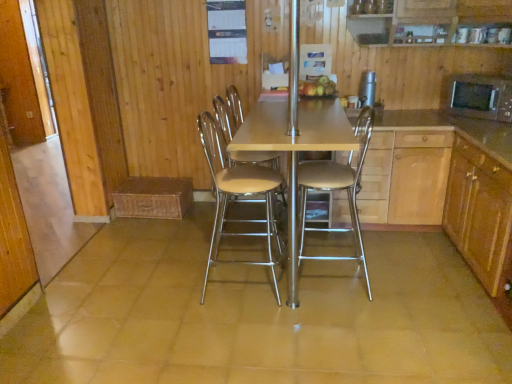
Question: Is matte wooden table at center positioned with its back to shiny golden apples at center?

Choices:
 (A) no
 (B) yes

Answer: (A)

Question: From a real-world perspective, is matte wooden table at center positioned over shiny golden apples at center based on gravity?

Choices:
 (A) yes
 (B) no

Answer: (B)

Question: Is matte wooden table at center bigger than shiny golden apples at center?

Choices:
 (A) yes
 (B) no

Answer: (A)

Question: Is matte wooden table at center completely or partially outside of shiny golden apples at center?

Choices:
 (A) yes
 (B) no

Answer: (A)

Question: From a real-world perspective, is matte wooden table at center under shiny golden apples at center?

Choices:
 (A) yes
 (B) no

Answer: (A)

Question: Considering their positions, is metallic stainless steel water dispenser at upper center, which is the 1th appliance from left to right, located in front of or behind black matte microwave at right, the first appliance viewed from the right?

Choices:
 (A) behind
 (B) front

Answer: (A)

Question: Which is correct: metallic stainless steel water dispenser at upper center, which is the 1th appliance from left to right, is inside black matte microwave at right, the 2th appliance in the left-to-right sequence, or outside of it?

Choices:
 (A) outside
 (B) inside

Answer: (A)

Question: From a real-world perspective, is metallic stainless steel water dispenser at upper center, which is the second appliance from right to left, above or below black matte microwave at right, the first appliance viewed from the right?

Choices:
 (A) above
 (B) below

Answer: (A)

Question: Considering the positions of metallic stainless steel water dispenser at upper center, which is the 1th appliance from left to right, and black matte microwave at right, the first appliance viewed from the right, in the image, is metallic stainless steel water dispenser at upper center, which is the 1th appliance from left to right, wider or thinner than black matte microwave at right, the first appliance viewed from the right,?

Choices:
 (A) wide
 (B) thin

Answer: (B)

Question: Considering their positions, is matte wooden table at center located in front of or behind metallic stainless steel water dispenser at upper center, which is the second appliance from right to left?

Choices:
 (A) behind
 (B) front

Answer: (B)

Question: From the image's perspective, is matte wooden table at center above or below metallic stainless steel water dispenser at upper center, which is the second appliance from right to left?

Choices:
 (A) above
 (B) below

Answer: (B)

Question: Considering the positions of point (326, 173) and point (373, 86), is point (326, 173) closer or farther from the camera than point (373, 86)?

Choices:
 (A) farther
 (B) closer

Answer: (B)

Question: Is matte wooden table at center taller or shorter than metallic stainless steel water dispenser at upper center, which is the 1th appliance from left to right?

Choices:
 (A) short
 (B) tall

Answer: (B)

Question: Considering the positions of matte wooden table at center and black matte microwave at right, the 2th appliance in the left-to-right sequence, in the image, is matte wooden table at center bigger or smaller than black matte microwave at right, the 2th appliance in the left-to-right sequence,?

Choices:
 (A) big
 (B) small

Answer: (A)

Question: Considering their positions, is matte wooden table at center located in front of or behind black matte microwave at right, the 2th appliance in the left-to-right sequence?

Choices:
 (A) front
 (B) behind

Answer: (A)